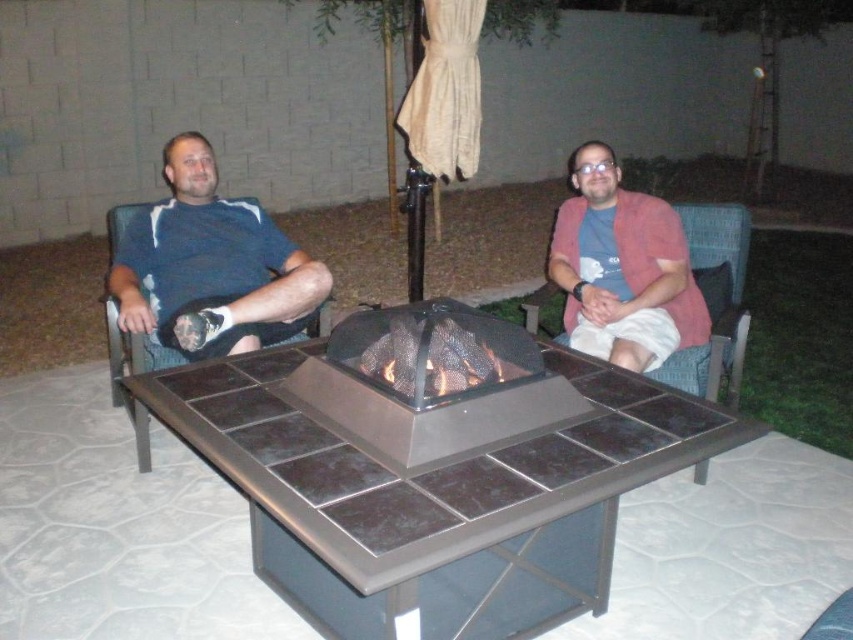
From the picture: You are standing at the edge of the patio looking towards the fire pit. There are two people sitting around it. The person wearing the matte blue shirt at left is sitting where in relation to the pink fabric jacket at right?

The matte blue shirt at left is to the left of the pink fabric jacket at right, so the person in the matte blue shirt at left is sitting to the left side of the person in the pink fabric jacket at right.

You are standing at the origin point of the coordinate system in the image. You need to locate the matte blue shirt at left. Which direction should you move to reach it?

The matte blue shirt at left is located at coordinate point 0.412 on the x axis and 0.249 on the y axis. Since you are at the origin, you should move right along the x axis to 0.412 and up along the y axis to 0.249 to reach it.

Looking at this image, you are standing in front of the fire pit and want to place a small decoration between the two points labeled point (x=415, y=353) and point (x=727, y=236). Which point should you move towards to place the decoration closer to the camera?

To place the decoration closer to the camera, you should move towards point (x=415, y=353) because it is closer to the camera than point (x=727, y=236).